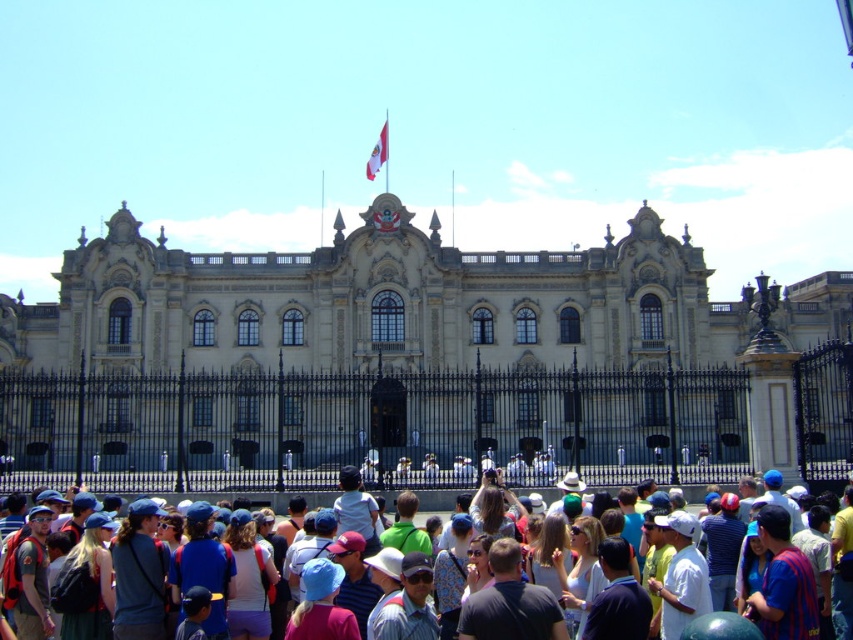
You are a photographer planning to take a portrait of two people wearing the multicolored casual attire at center and the white cotton shirt at center. Which clothing item will appear larger in the photo?

The multicolored casual attire at center will appear larger in the photo because it is bigger than the white cotton shirt at center.

You are an event organizer planning a photo shoot in front of the ornate building. You have two outfits to choose from for the model to wear. The outfits are the multicolored casual attire at center and the white cotton shirt at center. Based on their sizes, which outfit would make the model appear more prominent in the photo?

The multicolored casual attire at center is taller than the white cotton shirt at center, so choosing the multicolored casual attire at center would make the model appear more prominent in the photo.

You are a photographer standing in front of the ornate building. You want to take a photo that includes both the flagpole with the Peruvian flag and the central emblem above the main entrance. The flagpole is located at point (428, 492) and the central emblem is at point (589, 531). Which of these two points is closer to your camera position?

Point (428, 492) is closer to the camera than point (589, 531) because it is further to the camera according to the description.